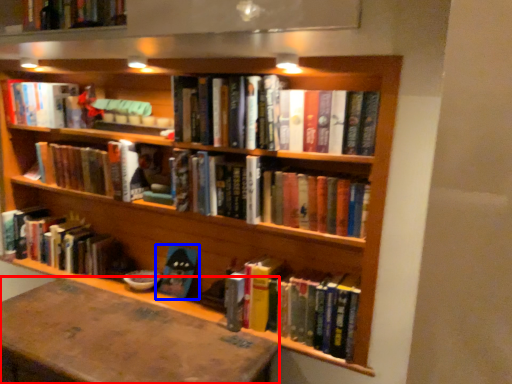
Question: Which object is further to the camera taking this photo, table (highlighted by a red box) or book (highlighted by a blue box)?

Choices:
 (A) table
 (B) book

Answer: (B)